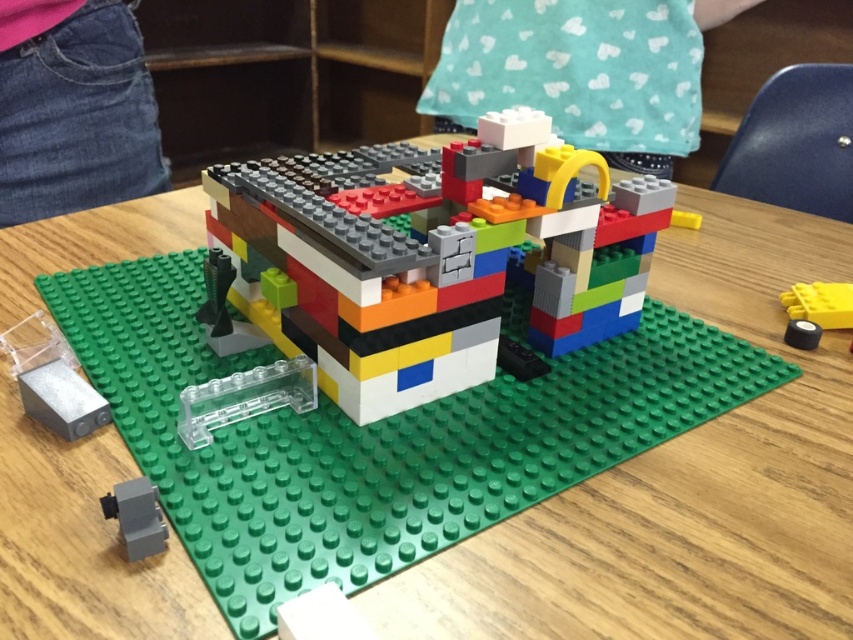
How much distance is there between white matte shirt at upper center and denim jeans at lower left?

86.66 centimeters

Can you confirm if white matte shirt at upper center is smaller than denim jeans at lower left?

No, white matte shirt at upper center is not smaller than denim jeans at lower left.

Where is `white matte shirt at upper center`? white matte shirt at upper center is located at coordinates (582, 72).

Can you confirm if multicolored plastic toy at center is thinner than yellow matte brick at lower right?

Incorrect, multicolored plastic toy at center's width is not less than yellow matte brick at lower right's.

Which is in front, point (415, 243) or point (845, 292)?

Point (415, 243) is more forward.

Is point (468, 275) more distant than point (828, 308)?

No, (468, 275) is closer to viewer.

Image resolution: width=853 pixels, height=640 pixels. In order to click on multicolored plastic toy at center in this screenshot , I will do `click(428, 256)`.

Who is shorter, white matte shirt at upper center or yellow matte brick at lower right?

Standing shorter between the two is yellow matte brick at lower right.

Measure the distance between white matte shirt at upper center and camera.

white matte shirt at upper center and camera are 4.83 feet apart from each other.

Is point (457, 99) farther from viewer compared to point (828, 300)?

Yes.

Where is `white matte shirt at upper center`? This screenshot has height=640, width=853. white matte shirt at upper center is located at coordinates 582,72.